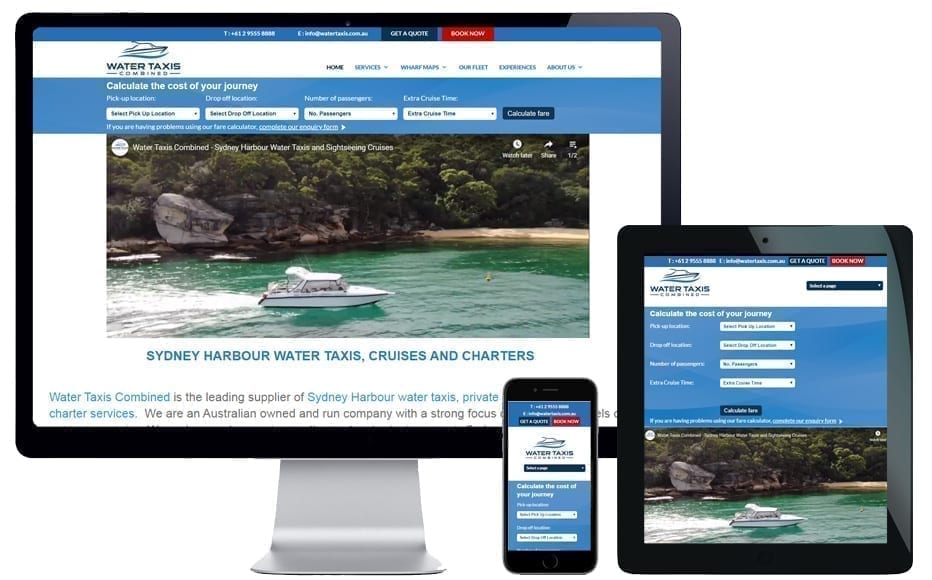
I want to click on devices, so click(303, 433), click(553, 393), click(720, 244).